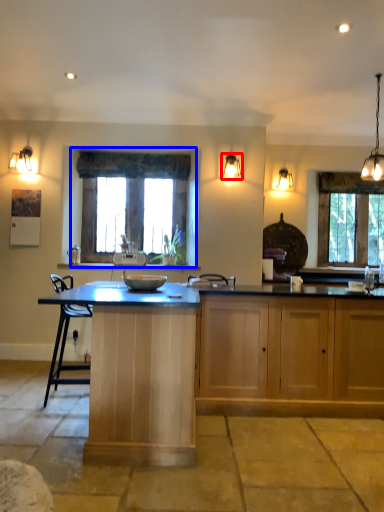
Question: Among these objects, which one is nearest to the camera, lamp (highlighted by a red box) or window (highlighted by a blue box)?

Choices:
 (A) lamp
 (B) window

Answer: (A)